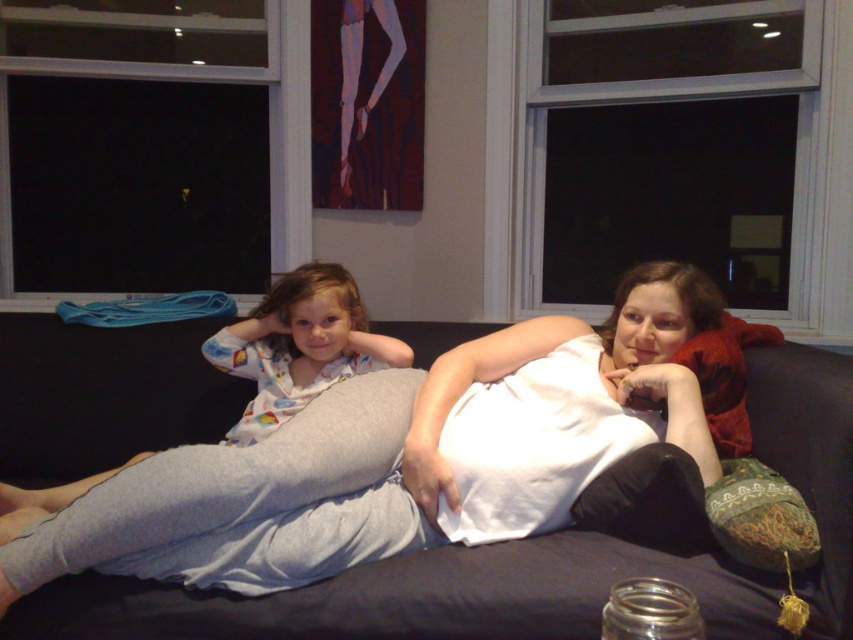
Who is shorter, dark gray fabric couch at center or light gray cotton pajama pants at left?

dark gray fabric couch at center is shorter.

Which is behind, point (561, 536) or point (267, 317)?

The point (267, 317) is more distant.

Find the location of a particular element. dark gray fabric couch at center is located at coordinates (408, 598).

Does point (840, 589) come in front of point (250, 417)?

Yes, it is.

Can you confirm if dark gray fabric couch at center is positioned below white cotton pajamas at center?

Yes, dark gray fabric couch at center is below white cotton pajamas at center.

Measure the distance between dark gray fabric couch at center and camera.

dark gray fabric couch at center and camera are 1.38 meters apart from each other.

Find the location of a particular element. This screenshot has width=853, height=640. dark gray fabric couch at center is located at coordinates (408, 598).

From the picture: Can you confirm if light gray cotton pajama pants at left is positioned to the left of white cotton pajamas at center?

Yes, light gray cotton pajama pants at left is to the left of white cotton pajamas at center.

Does light gray cotton pajama pants at left appear under white cotton pajamas at center?

Indeed, light gray cotton pajama pants at left is positioned under white cotton pajamas at center.

Is point (265, 326) less distant than point (276, 404)?

No.

Where is `light gray cotton pajama pants at left`? light gray cotton pajama pants at left is located at coordinates (299, 346).